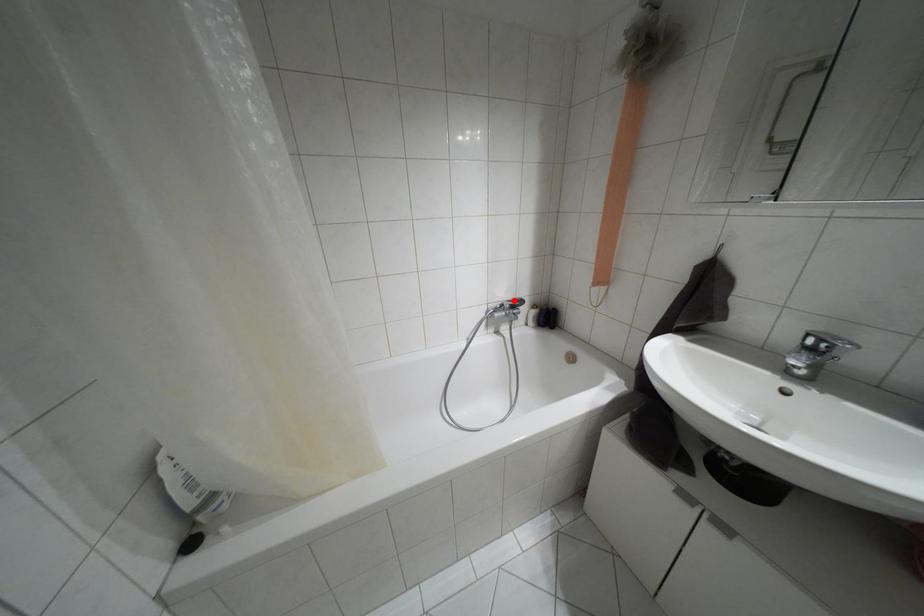
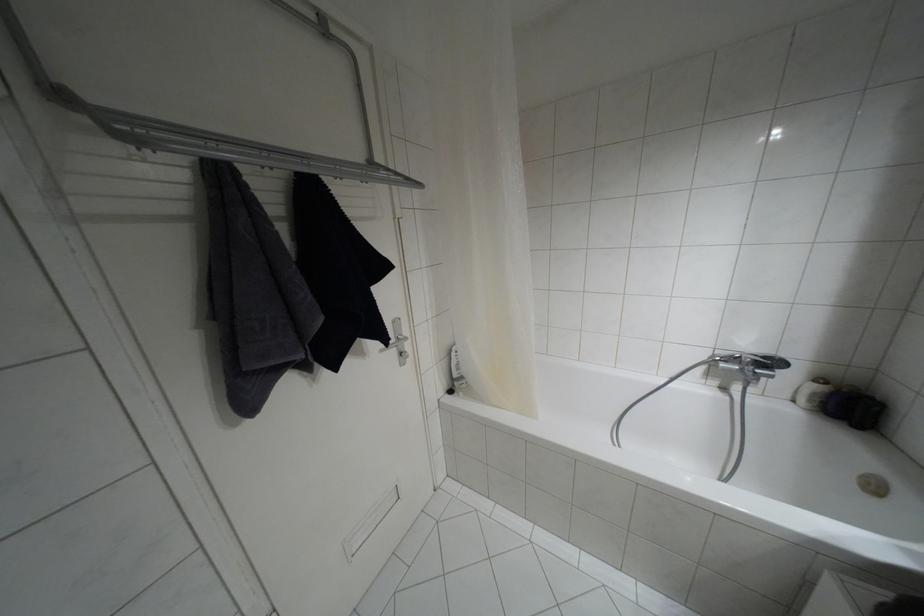
Question: I am providing you with two images of the same scene from different viewpoints. A red point is marked on the first image. At the location where the point appears in image 1, is it still visible in image 2?

Choices:
 (A) Yes
 (B) No

Answer: (A)